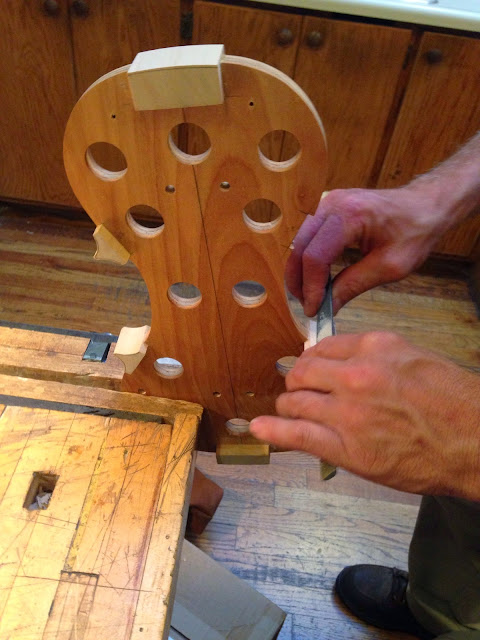
The width and height of the screenshot is (480, 640). I want to click on work table, so click(x=112, y=512).